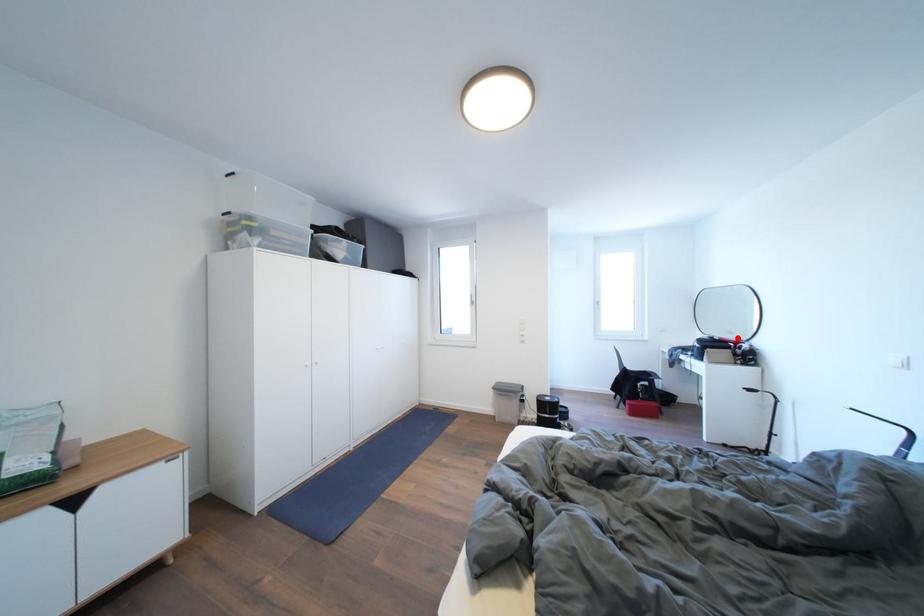
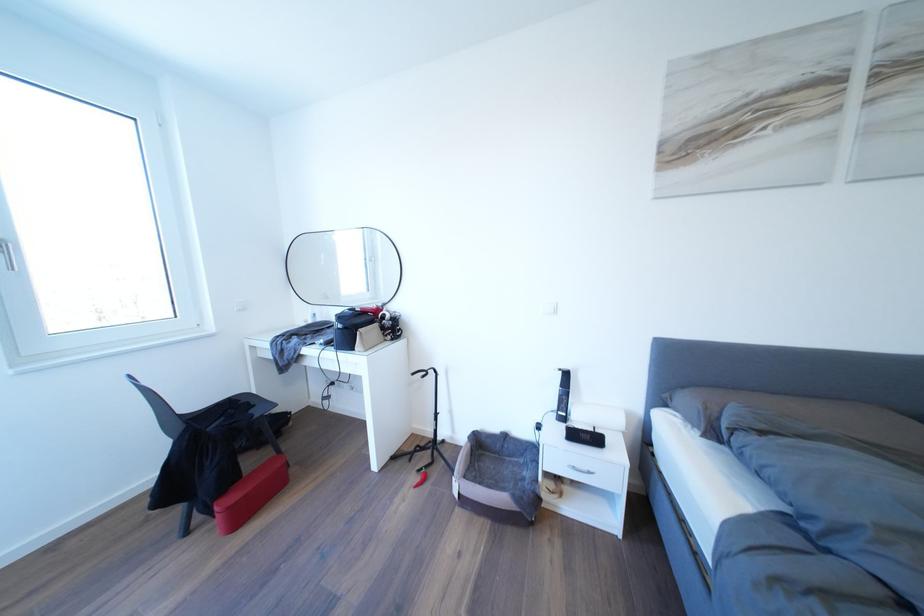
In the second image, find the point that corresponds to the highlighted location in the first image.

(334, 302)